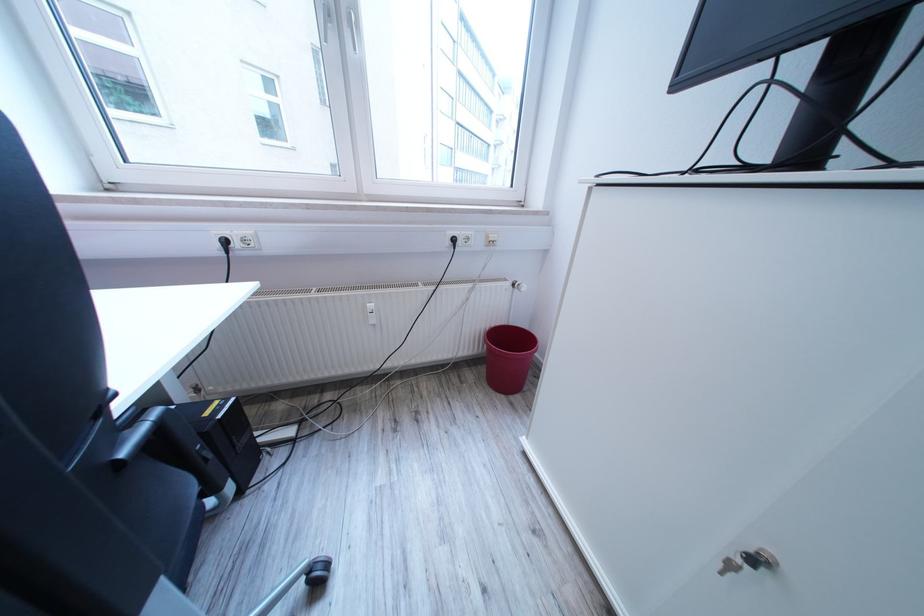
The location [318,570] corresponds to which object?

It corresponds to the black power plug in the image.